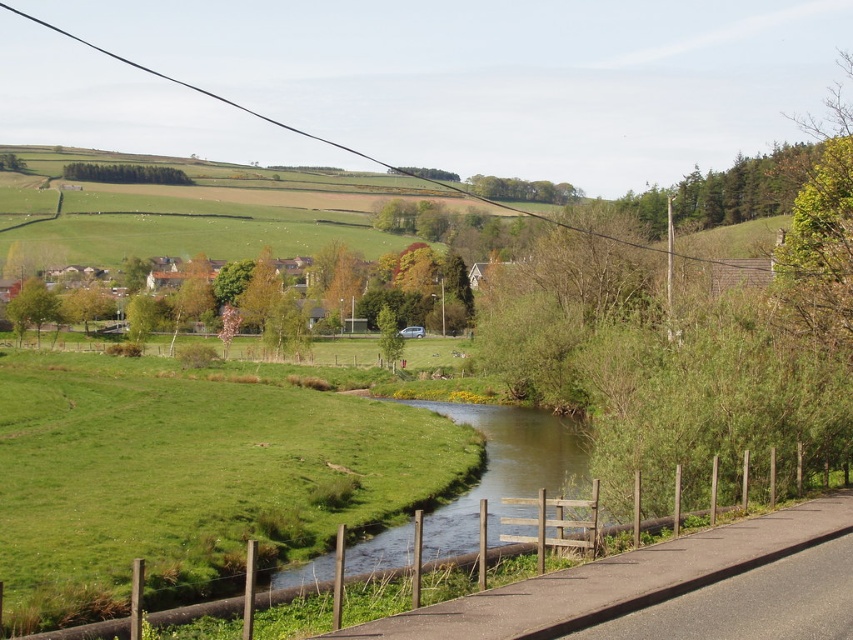
You are standing at the camera position looking at the landscape. There are two points marked in the image, one at point coordinates point (x=300, y=570) and another at point (x=142, y=179). Which point is closer to you?

Point (x=300, y=570) is closer to the camera than point (x=142, y=179).

You are standing on the paved road and want to take a photo of the green leafy trees at upper left without the green grassy stream at center blocking the view. Is it possible?

The green grassy stream at center is in front of the green leafy trees at upper left, so it will block the view. To avoid the stream, you need to move to a higher position or angle your camera to exclude the stream from the frame.